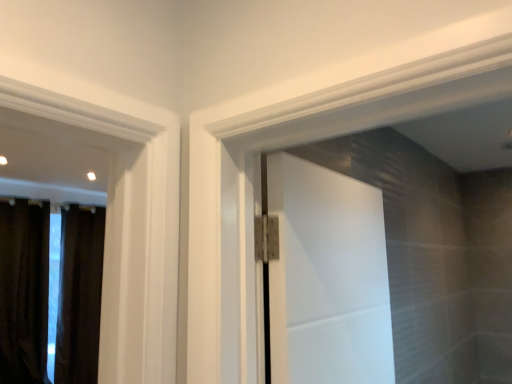
Measure the distance between white matte door at center and camera.

white matte door at center is 36.07 inches from camera.

What do you see at coordinates (327, 277) in the screenshot? This screenshot has width=512, height=384. I see `white matte door at center` at bounding box center [327, 277].

Image resolution: width=512 pixels, height=384 pixels. I want to click on white matte door at center, so click(327, 277).

This screenshot has height=384, width=512. Find the location of `white matte door at center`. white matte door at center is located at coordinates (327, 277).